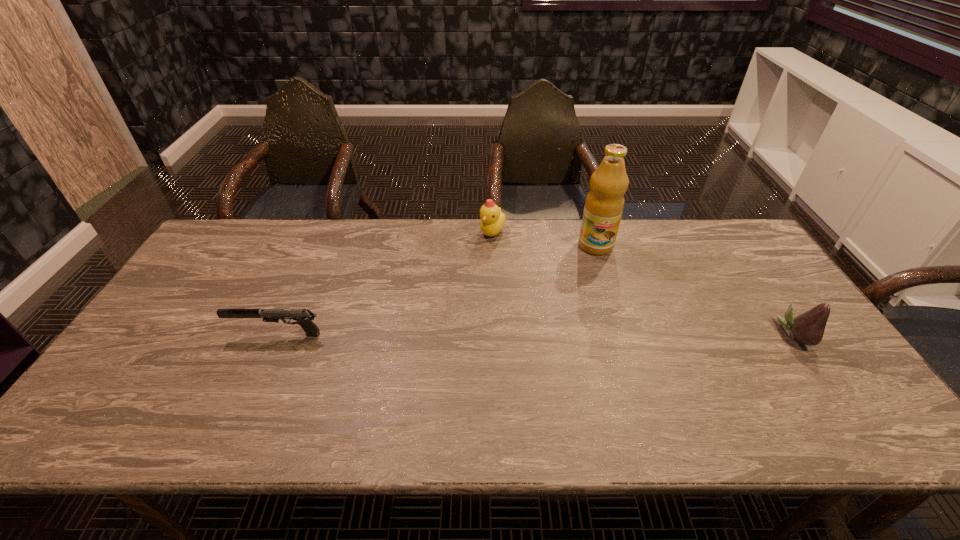
Find the location of `gun`. gun is located at coordinates click(x=304, y=317).

What are the coordinates of `the leftmost object` in the screenshot? It's located at (304, 317).

The height and width of the screenshot is (540, 960). In order to click on the rightmost object in this screenshot , I will do pos(808,328).

Locate an element on the screen. The width and height of the screenshot is (960, 540). the second object from left to right is located at coordinates (492, 219).

This screenshot has height=540, width=960. I want to click on the third object from left to right, so click(x=604, y=204).

Identify the location of olive oil. The height and width of the screenshot is (540, 960). (604, 204).

At what (x,y) coordinates should I click in order to perform the action: click on vacant space located at the muzzle end of the leftmost object. Please return your answer as a coordinate pair (x, y). Looking at the image, I should click on (148, 334).

Image resolution: width=960 pixels, height=540 pixels. Find the location of `vacant space located 0.230m at the muzzle end of the leftmost object`. vacant space located 0.230m at the muzzle end of the leftmost object is located at coordinates (144, 334).

Identify the location of vacant region located at the muzzle end of the leftmost object. The width and height of the screenshot is (960, 540). (193, 334).

The width and height of the screenshot is (960, 540). Find the location of `vacant area located 0.380m on the front-facing side of the third object from right to left`. vacant area located 0.380m on the front-facing side of the third object from right to left is located at coordinates [x=474, y=329].